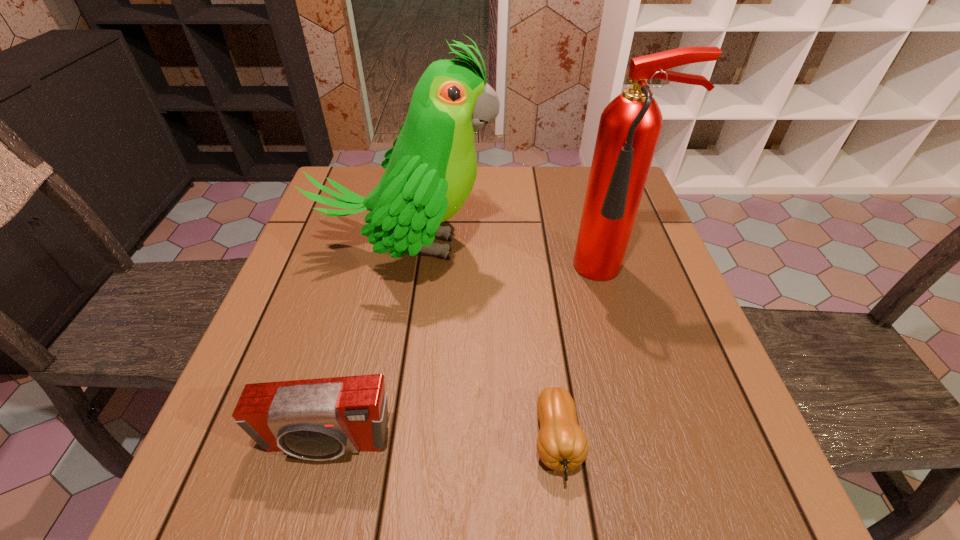
Image resolution: width=960 pixels, height=540 pixels. I want to click on unoccupied position between the shortest object and the parakeet, so click(482, 345).

You are a GUI agent. You are given a task and a screenshot of the screen. Output one action in this format:
    pyautogui.click(x=<x>, y=<y>)
    Task: Click on the unoccupied area between the rightmost object and the gourd
    
    Given the screenshot: What is the action you would take?
    pyautogui.click(x=586, y=356)

What are the coordinates of `vacant area between the third tallest object and the rightmost object` in the screenshot? It's located at (469, 357).

Locate an element on the screen. This screenshot has width=960, height=540. free space between the parakeet and the camera is located at coordinates (367, 346).

Image resolution: width=960 pixels, height=540 pixels. In order to click on free point between the fire extinguisher and the gourd in this screenshot , I will do `click(586, 356)`.

I want to click on free spot between the shortest object and the fire extinguisher, so click(x=586, y=356).

Locate an element on the screen. vacant area between the parakeet and the fire extinguisher is located at coordinates (511, 259).

Where is `free area in between the parakeet and the third tallest object`? The height and width of the screenshot is (540, 960). free area in between the parakeet and the third tallest object is located at coordinates (367, 346).

Find the location of `free space between the fire extinguisher and the parakeet`. free space between the fire extinguisher and the parakeet is located at coordinates (511, 259).

This screenshot has width=960, height=540. What are the coordinates of `vacant area between the parakeet and the gourd` in the screenshot? It's located at [482, 345].